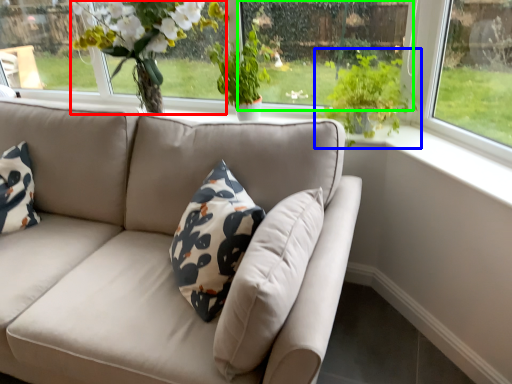
Question: Estimate the real-world distances between objects in this image. Which object is closer to floral arrangement (highlighted by a red box), houseplant (highlighted by a blue box) or window screen (highlighted by a green box)?

Choices:
 (A) houseplant
 (B) window screen

Answer: (B)